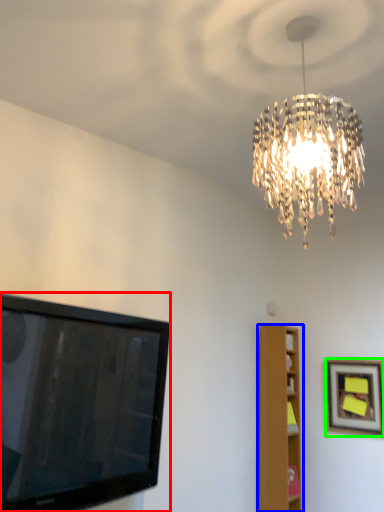
Question: Estimate the real-world distances between objects in this image. Which object is closer to television (highlighted by a red box), furniture (highlighted by a blue box) or picture frame (highlighted by a green box)?

Choices:
 (A) furniture
 (B) picture frame

Answer: (A)